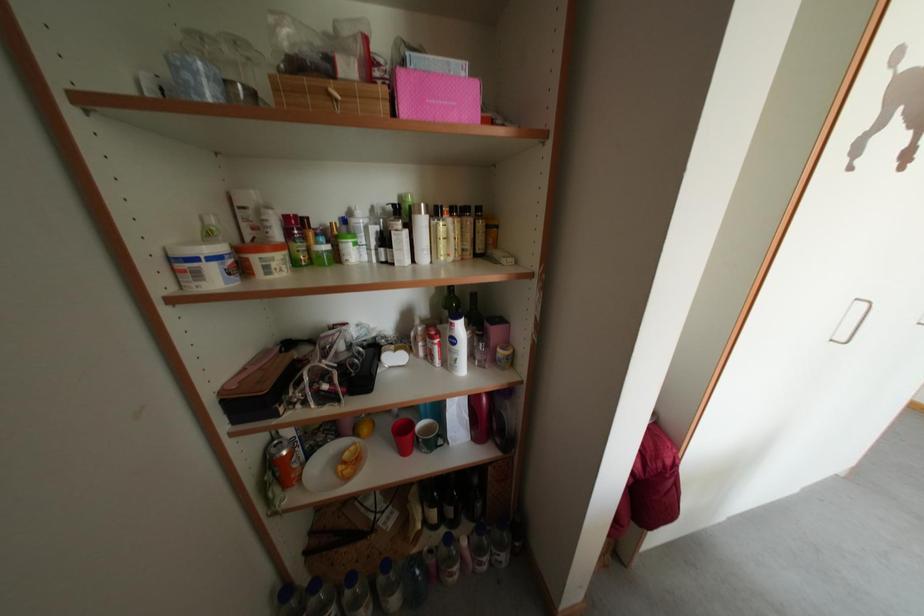
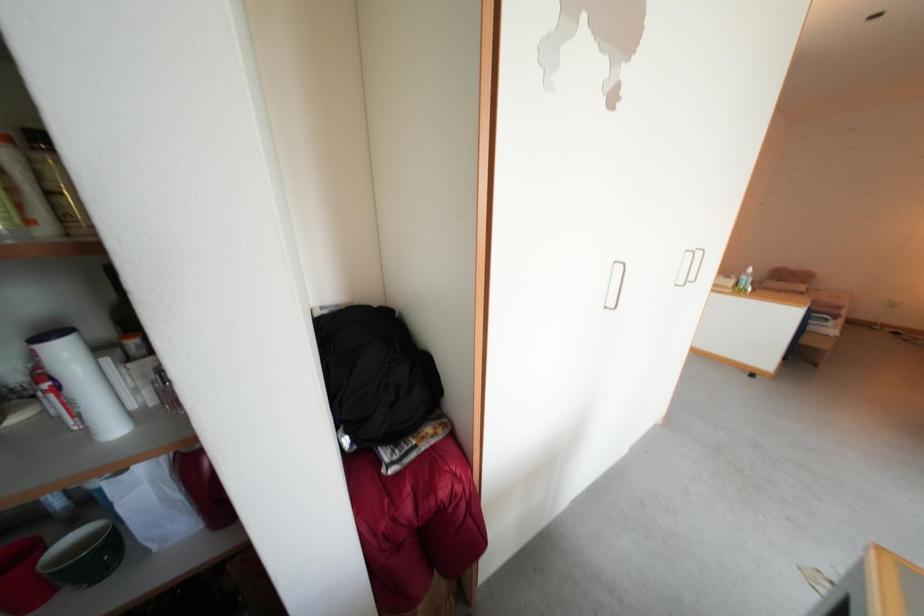
In a continuous first-person perspective shot, in which direction is the camera moving?

The movement direction of the cameraman is right, forward.